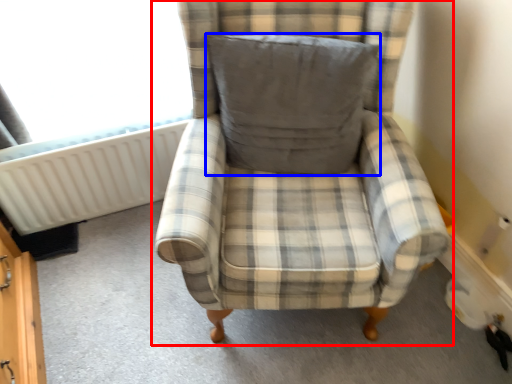
Question: Which object appears farthest to the camera in this image, chair (highlighted by a red box) or pillow (highlighted by a blue box)?

Choices:
 (A) chair
 (B) pillow

Answer: (B)